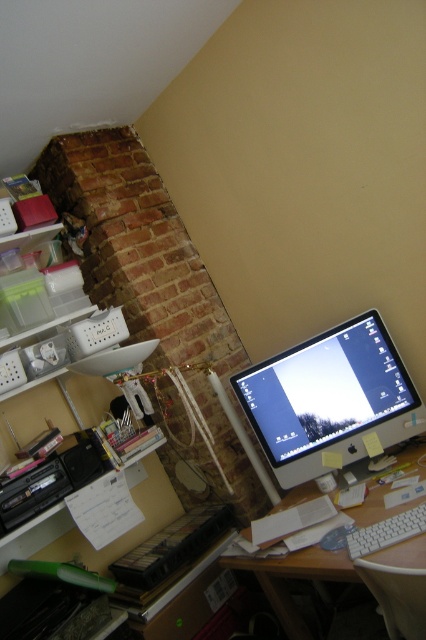
Question: Is white plastic computer desk at center below white plastic keyboard at lower right?

Choices:
 (A) yes
 (B) no

Answer: (A)

Question: Which point is farther from the camera taking this photo?

Choices:
 (A) 388,525
 (B) 334,356

Answer: (B)

Question: Is white plastic computer desk at center to the right of white plastic keyboard at lower right from the viewer's perspective?

Choices:
 (A) no
 (B) yes

Answer: (B)

Question: Can you confirm if satin silver monitor at center is positioned below white plastic keyboard at lower right?

Choices:
 (A) yes
 (B) no

Answer: (B)

Question: Which of the following is the farthest from the observer?

Choices:
 (A) (408, 531)
 (B) (336, 396)
 (C) (311, 564)

Answer: (B)

Question: Which of the following is the farthest from the observer?

Choices:
 (A) (265, 566)
 (B) (348, 552)

Answer: (A)